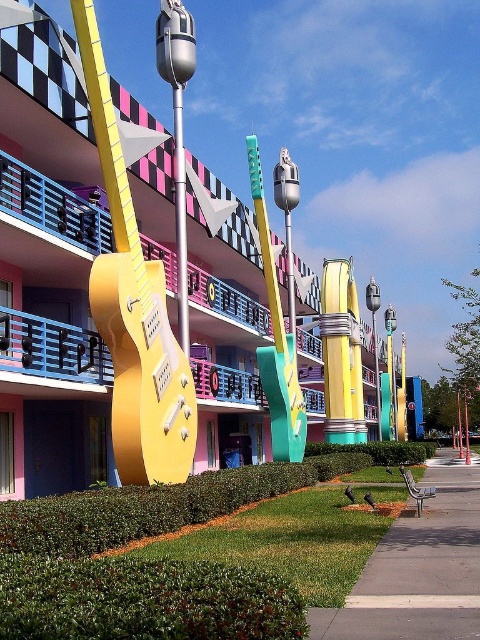
You are standing in front of the vibrant building with the guitar sculptures. There are two points marked on the facade. The first point is at coordinates point (371, 632) and the second is at point (179, 312). Which of these points is closer to you as you face the building?

Point (371, 632) is in front of point (179, 312), so it is closer to you as you face the building.

You are standing in front of the vibrant building with the guitar sculptures. There are two points marked on the facade. The first point is at coordinates point (120, 426) and the second is at point (439, 477). Which of these two points is closer to you?

Point (120, 426) is in front of point (439, 477), so it is closer to you.

You are a delivery person trying to park your 1.2 meter wide delivery cart near the gray concrete sidewalk at lower right. There is a gold metallic guitar at center hanging above the sidewalk. Can you safely park your cart on the sidewalk without it hitting the guitar?

The gold metallic guitar at center is positioned over the gray concrete sidewalk at lower right, but since it is hanging above, there should be enough vertical space for the delivery cart to park safely as long as there is no horizontal obstruction. However, ensure that the cart is parked directly under the guitar where the sidewalk is clear.